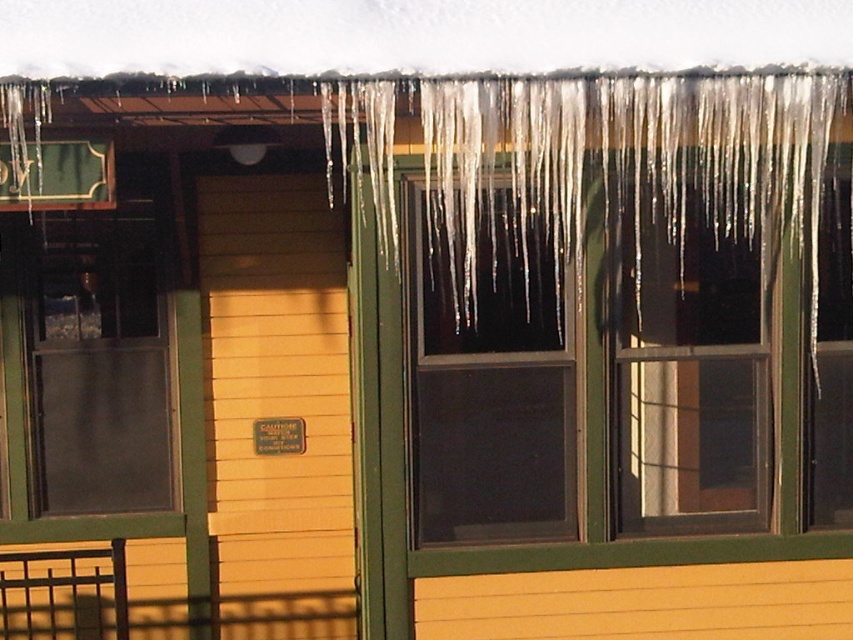
Does transparent glass window at upper center appear over transparent glass window at center?

No.

Does point (480, 481) come behind point (416, 372)?

Yes.

Does point (671, 260) come behind point (569, 417)?

Yes, point (671, 260) is behind point (569, 417).

Find the location of a particular element. transparent glass window at upper center is located at coordinates [610, 429].

Can you confirm if transparent glass window at center is thinner than transparent glass window at left?

Yes, transparent glass window at center is thinner than transparent glass window at left.

The image size is (853, 640). I want to click on transparent glass window at center, so click(491, 394).

Image resolution: width=853 pixels, height=640 pixels. Identify the location of transparent glass window at center. pyautogui.click(x=491, y=394).

Does transparent glass window at upper center have a greater width compared to transparent glass window at left?

Yes, transparent glass window at upper center is wider than transparent glass window at left.

Based on the photo, is transparent glass window at upper center positioned behind transparent glass window at left?

That is False.

This screenshot has height=640, width=853. Identify the location of transparent glass window at upper center. (610, 429).